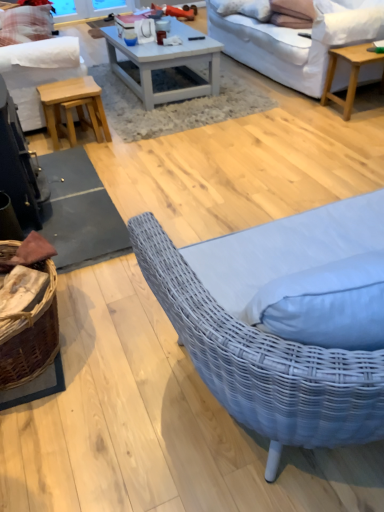
The width and height of the screenshot is (384, 512). What are the coordinates of `vacant space underneath light wood/texture coffee table at upper right, which is the first coffee table in right-to-left order (from a real-world perspective)` in the screenshot? It's located at (367, 109).